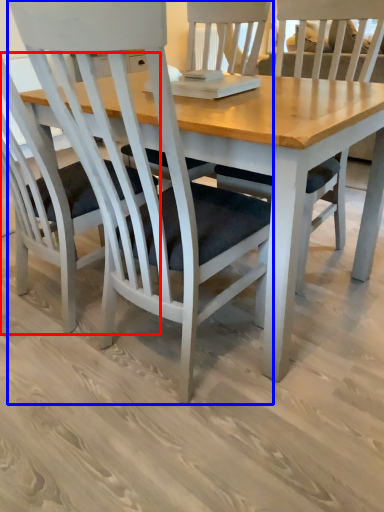
Question: Which object is closer to the camera taking this photo, chair (highlighted by a red box) or chair (highlighted by a blue box)?

Choices:
 (A) chair
 (B) chair

Answer: (B)